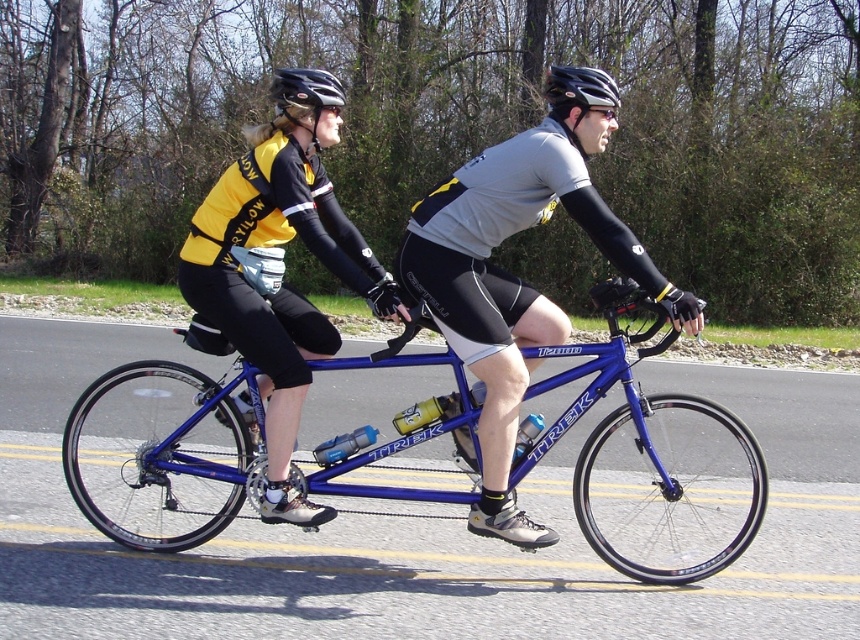
Is matte blue bicycle at center thinner than black matte helmet at center?

No, matte blue bicycle at center is not thinner than black matte helmet at center.

Is point (449, 272) positioned before point (602, 102)?

Yes, it is.

This screenshot has width=860, height=640. Describe the element at coordinates (492, 284) in the screenshot. I see `matte blue bicycle at center` at that location.

Locate an element on the screen. matte blue bicycle at center is located at coordinates (492, 284).

Can you confirm if black matte helmet at center is positioned to the left of black matte helmet at upper center?

Incorrect, black matte helmet at center is not on the left side of black matte helmet at upper center.

Does black matte helmet at center have a greater width compared to black matte helmet at upper center?

Incorrect, black matte helmet at center's width does not surpass black matte helmet at upper center's.

The height and width of the screenshot is (640, 860). What do you see at coordinates (578, 93) in the screenshot? I see `black matte helmet at center` at bounding box center [578, 93].

The image size is (860, 640). Find the location of `black matte helmet at center`. black matte helmet at center is located at coordinates (578, 93).

Which is behind, point (603, 394) or point (587, 92)?

Point (603, 394)

Is blue metallic bicycle at center positioned behind black matte helmet at center?

That is True.

Does point (132, 412) come farther from viewer compared to point (591, 93)?

Yes, it is.

I want to click on blue metallic bicycle at center, so click(x=649, y=461).